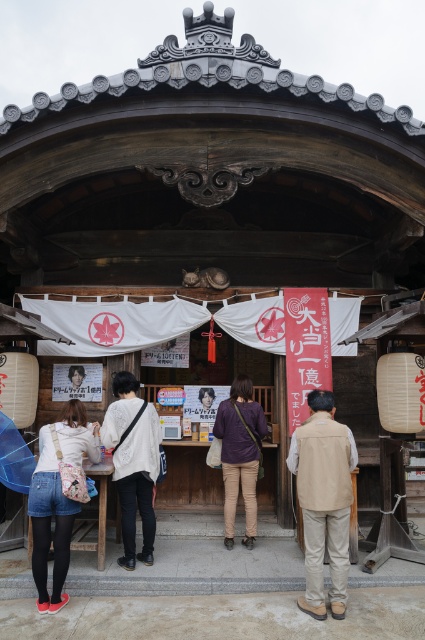
Which of these two, white lace shirt at center or purple cotton shirt at center, stands shorter?

purple cotton shirt at center is shorter.

Does white lace shirt at center have a lesser height compared to purple cotton shirt at center?

Incorrect, white lace shirt at center's height does not fall short of purple cotton shirt at center's.

Image resolution: width=425 pixels, height=640 pixels. What are the coordinates of `white lace shirt at center` in the screenshot? It's located at (133, 461).

Who is taller, denim shorts at lower left or purple cotton shirt at center?

purple cotton shirt at center is taller.

Is denim shorts at lower left above purple cotton shirt at center?

Incorrect, denim shorts at lower left is not positioned above purple cotton shirt at center.

Describe the element at coordinates (50, 524) in the screenshot. The image size is (425, 640). I see `denim shorts at lower left` at that location.

Find the location of a particular element. Image resolution: width=425 pixels, height=640 pixels. denim shorts at lower left is located at coordinates click(50, 524).

Is point (317, 608) closer to viewer compared to point (149, 420)?

Yes.

Is beige fabric vest at lower right shorter than white lace shirt at center?

Yes, beige fabric vest at lower right is shorter than white lace shirt at center.

Which is behind, point (342, 486) or point (158, 467)?

The point (158, 467) is more distant.

Identify the location of beige fabric vest at lower right. This screenshot has height=640, width=425. (323, 500).